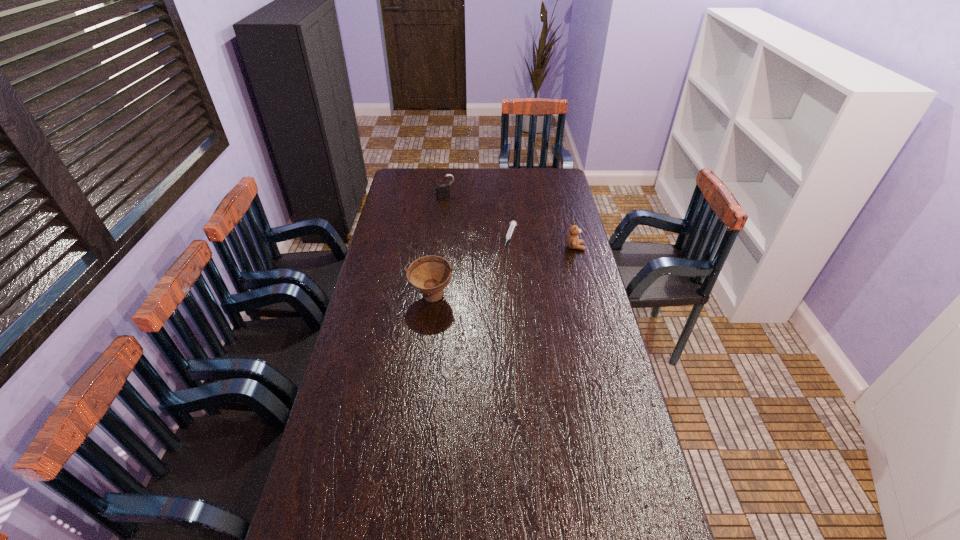
This screenshot has width=960, height=540. What are the coordinates of `free area in between the farthest object and the soup bowl` in the screenshot? It's located at (439, 247).

This screenshot has height=540, width=960. In order to click on free area in between the teddy bear and the tallest object in this screenshot , I will do `click(503, 272)`.

Where is `free point between the second object from right to left and the teddy bear`? free point between the second object from right to left and the teddy bear is located at coordinates (543, 241).

Find the location of a particular element. vacant space that's between the soup bowl and the farthest object is located at coordinates (439, 247).

Where is `free point between the farthest object and the second object from right to left`? free point between the farthest object and the second object from right to left is located at coordinates (478, 217).

The image size is (960, 540). I want to click on empty location between the soup bowl and the farthest object, so click(x=439, y=247).

The image size is (960, 540). In order to click on free space that is in between the padlock and the rightmost object in this screenshot , I will do `click(511, 222)`.

The image size is (960, 540). What are the coordinates of `blank region between the teddy bear and the third object from left to right` in the screenshot? It's located at (543, 241).

What are the coordinates of `free space that is in between the teddy bear and the nearest object` in the screenshot? It's located at (503, 272).

Locate an element on the screen. The width and height of the screenshot is (960, 540). object that is the closest to the teddy bear is located at coordinates (512, 224).